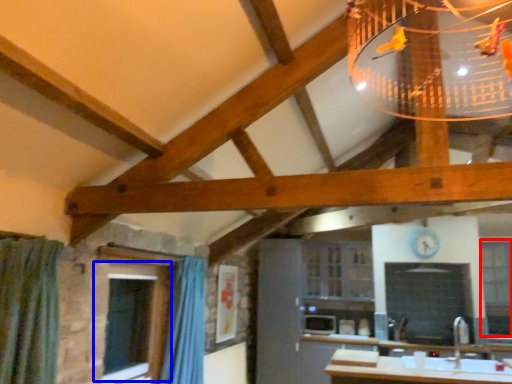
Question: Which of the following is the farthest to the observer, window (highlighted by a red box) or window (highlighted by a blue box)?

Choices:
 (A) window
 (B) window

Answer: (A)